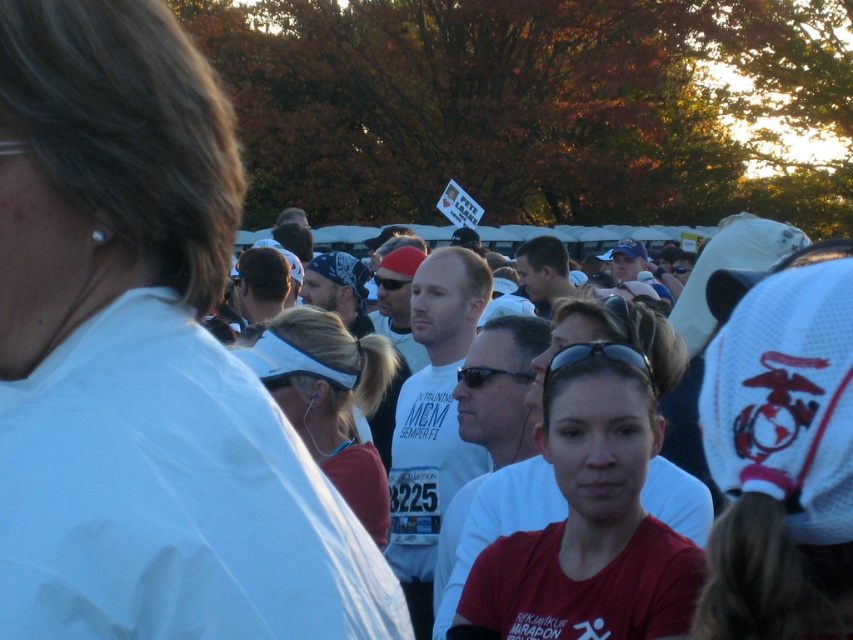
Does white matte shirt at upper left come in front of white matte visor at center?

That is True.

Which of these two, white matte shirt at upper left or white matte visor at center, stands taller?

Standing taller between the two is white matte shirt at upper left.

Does point (119, 538) lie in front of point (288, 396)?

Yes, it is in front of point (288, 396).

This screenshot has height=640, width=853. Find the location of `white matte shirt at upper left`. white matte shirt at upper left is located at coordinates (144, 362).

Which is more to the right, white matte shirt at upper left or matte red shirt at center?

matte red shirt at center

Find the location of `white matte shirt at upper left`. white matte shirt at upper left is located at coordinates (144, 362).

How much distance is there between matte red shirt at center and black plastic sunglasses at center?

matte red shirt at center is 10.18 inches from black plastic sunglasses at center.

Looking at this image, can you confirm if matte red shirt at center is taller than black plastic sunglasses at center?

Indeed, matte red shirt at center has a greater height compared to black plastic sunglasses at center.

Measure the distance between point (625, 408) and camera.

A distance of 3.89 meters exists between point (625, 408) and camera.

Locate an element on the screen. matte red shirt at center is located at coordinates (589, 525).